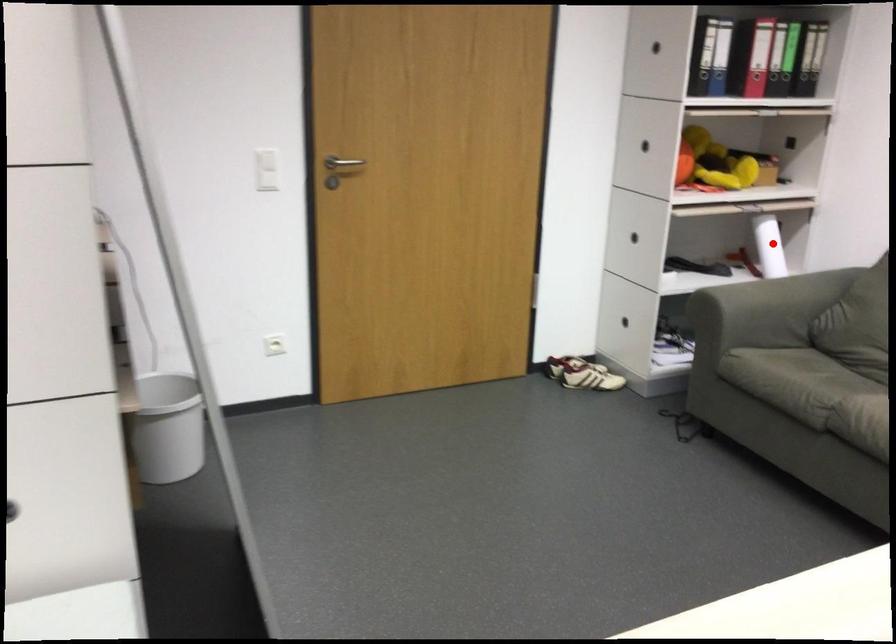
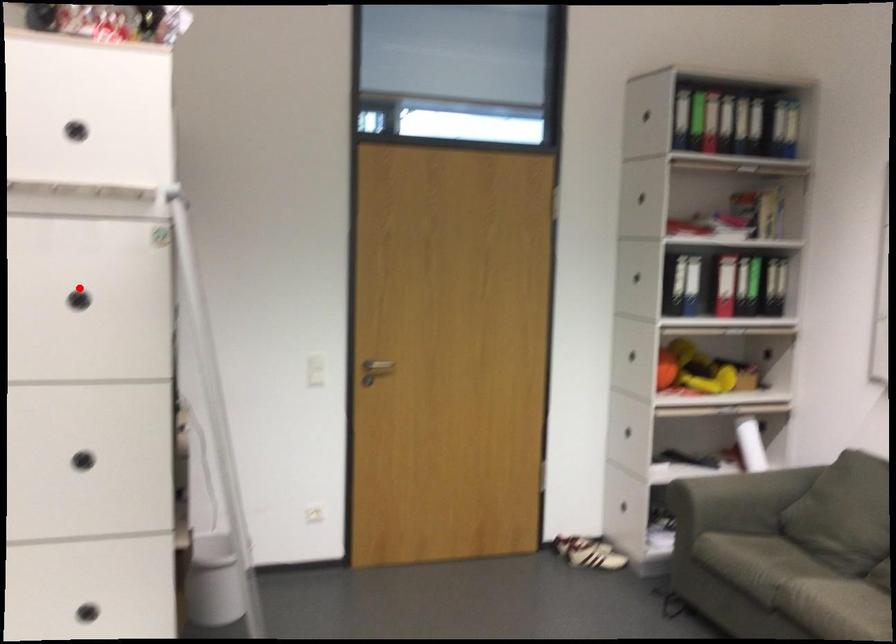
I am providing you with two images of the same scene from different viewpoints. A red point is marked on the first image and another point is marked on the second image. Is the red point in image1 aligned with the point shown in image2?

No